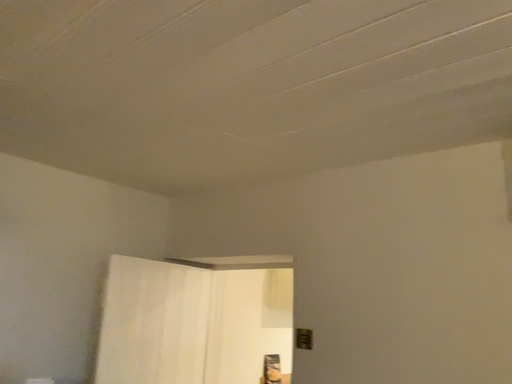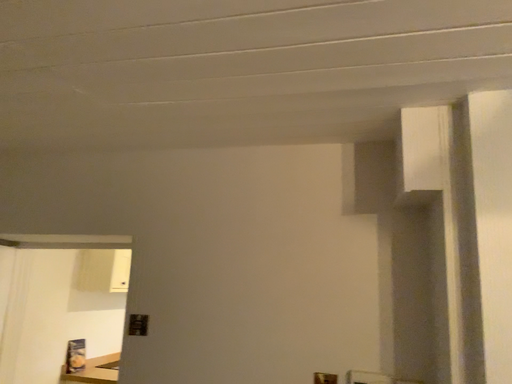
Question: How did the camera likely rotate when shooting the video?

Choices:
 (A) rotated left
 (B) rotated right

Answer: (B)